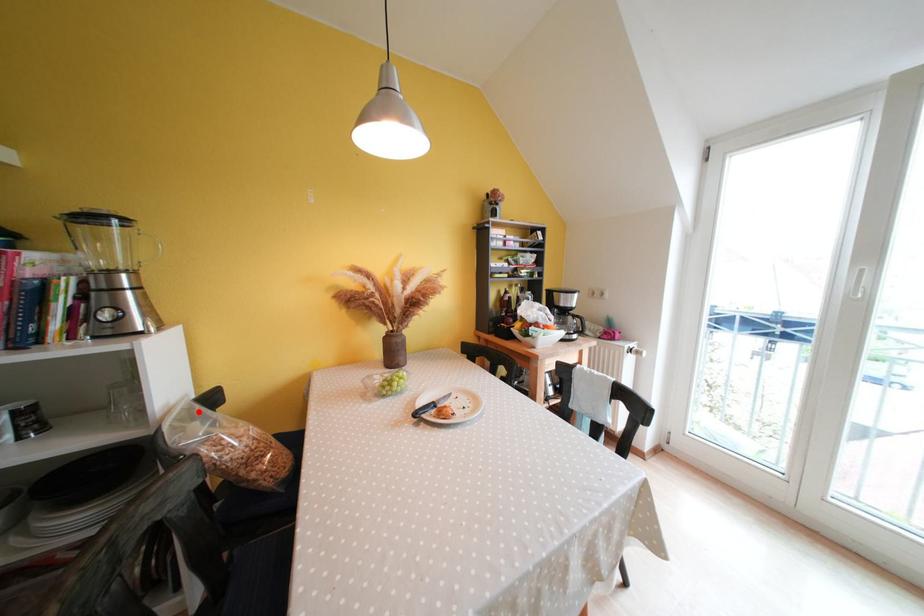
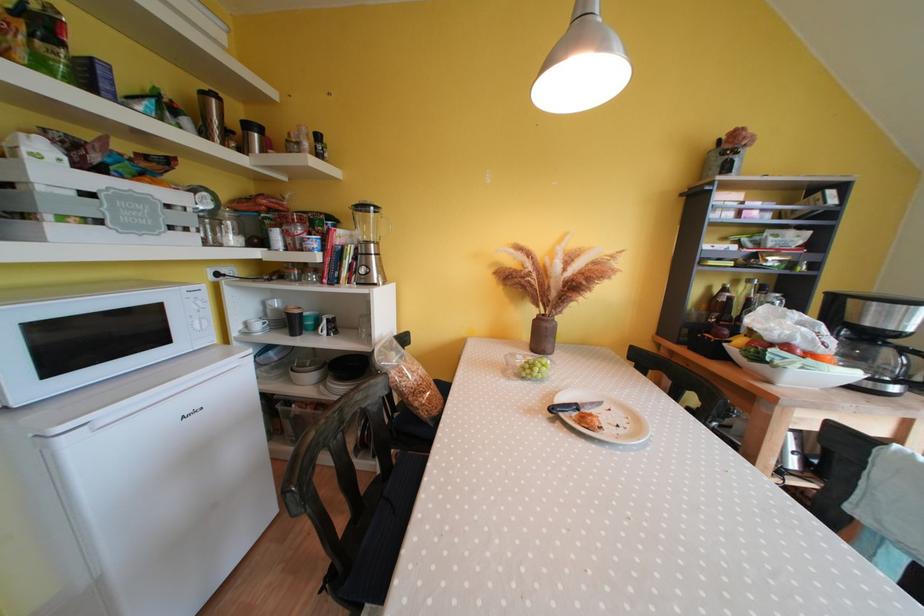
Locate, in the second image, the point that corresponds to the highlighted location in the first image.

(397, 345)